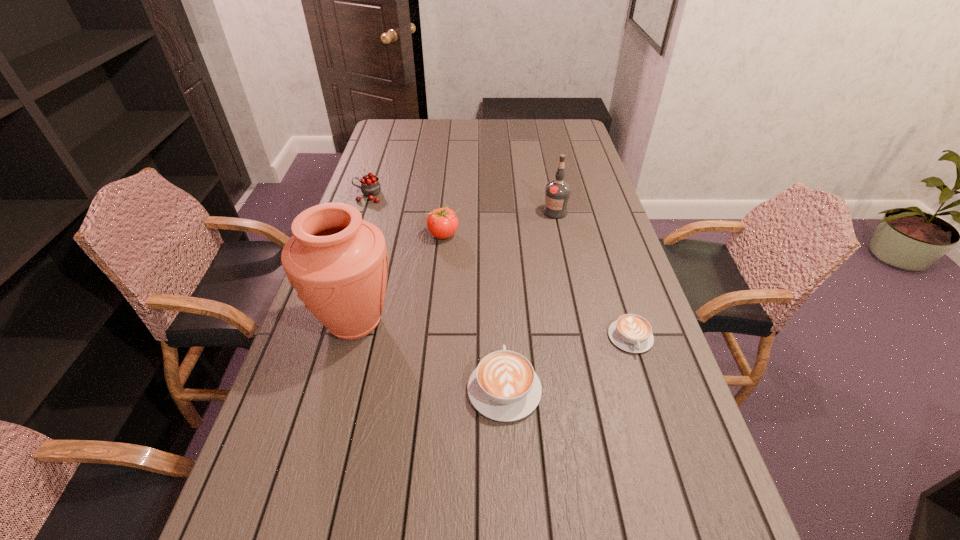
I want to click on the fourth object from left to right, so click(504, 387).

Find the location of `the left cappuccino`. the left cappuccino is located at coordinates (504, 387).

The width and height of the screenshot is (960, 540). I want to click on the rightmost object, so click(x=632, y=333).

Find the location of `the farther cappuccino`. the farther cappuccino is located at coordinates (632, 333).

Find the location of `the fifth shortest object`. the fifth shortest object is located at coordinates (557, 192).

At what (x,y) coordinates should I click in order to perform the action: click on vodka. Please return your answer as a coordinate pair (x, y). Image resolution: width=960 pixels, height=540 pixels. Looking at the image, I should click on (557, 192).

You are a GUI agent. You are given a task and a screenshot of the screen. Output one action in this format:
    pyautogui.click(x=<x>, y=<y>)
    Task: Click on the farthest object
    
    Given the screenshot: What is the action you would take?
    pyautogui.click(x=370, y=186)

Identify the location of vase. The height and width of the screenshot is (540, 960). (338, 263).

Where is `tomato`? tomato is located at coordinates (442, 223).

Image resolution: width=960 pixels, height=540 pixels. Identify the location of the fourth object from right to left. (442, 223).